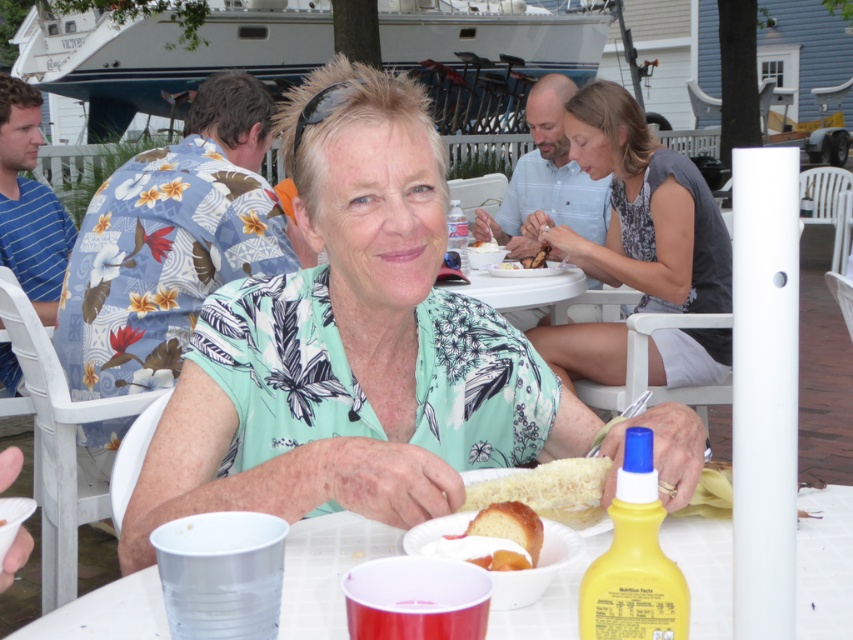
Measure the distance from white crumbly bread at center to white fluffy bread at center.

A distance of 2.24 meters exists between white crumbly bread at center and white fluffy bread at center.

Is point (602, 486) closer to viewer compared to point (480, 241)?

That is True.

What are the coordinates of `white crumbly bread at center` in the screenshot? It's located at (549, 490).

Does point (338, 481) lie behind point (497, 246)?

No, it is in front of (497, 246).

Which is behind, point (498, 353) or point (495, 250)?

Point (495, 250)

I want to click on green floral shirt at center, so click(350, 348).

Which is behind, point (224, 420) or point (503, 532)?

Point (224, 420)

Which is below, green floral shirt at center or yellow cake at center?

yellow cake at center

Find the location of a particular element. The height and width of the screenshot is (640, 853). green floral shirt at center is located at coordinates (350, 348).